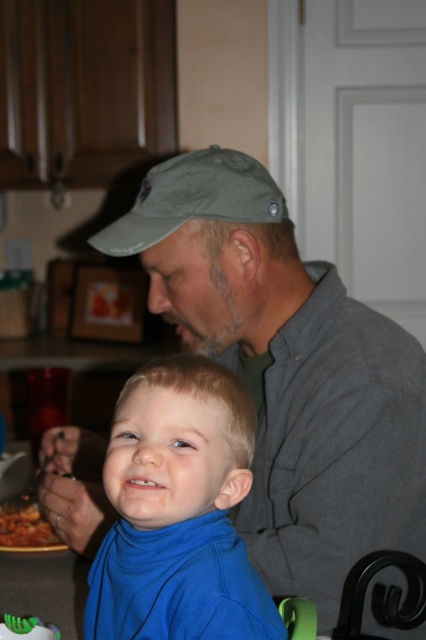
Question: Is olive green fabric baseball cap at upper center to the right of tomato sauce at lower left from the viewer's perspective?

Choices:
 (A) no
 (B) yes

Answer: (B)

Question: Among these objects, which one is nearest to the camera?

Choices:
 (A) gray cotton shirt at upper right
 (B) tomato sauce at lower left

Answer: (A)

Question: Which object appears closest to the camera in this image?

Choices:
 (A) tomato sauce at lower left
 (B) blue turtleneck shirt at center
 (C) olive green fabric baseball cap at upper center

Answer: (B)

Question: Does olive green fabric baseball cap at upper center have a smaller size compared to tomato sauce at lower left?

Choices:
 (A) yes
 (B) no

Answer: (B)

Question: Which point appears farthest from the camera in this image?

Choices:
 (A) (48, 528)
 (B) (167, 609)
 (C) (219, 196)

Answer: (A)

Question: Does gray cotton shirt at upper right have a greater width compared to tomato sauce at lower left?

Choices:
 (A) no
 (B) yes

Answer: (B)